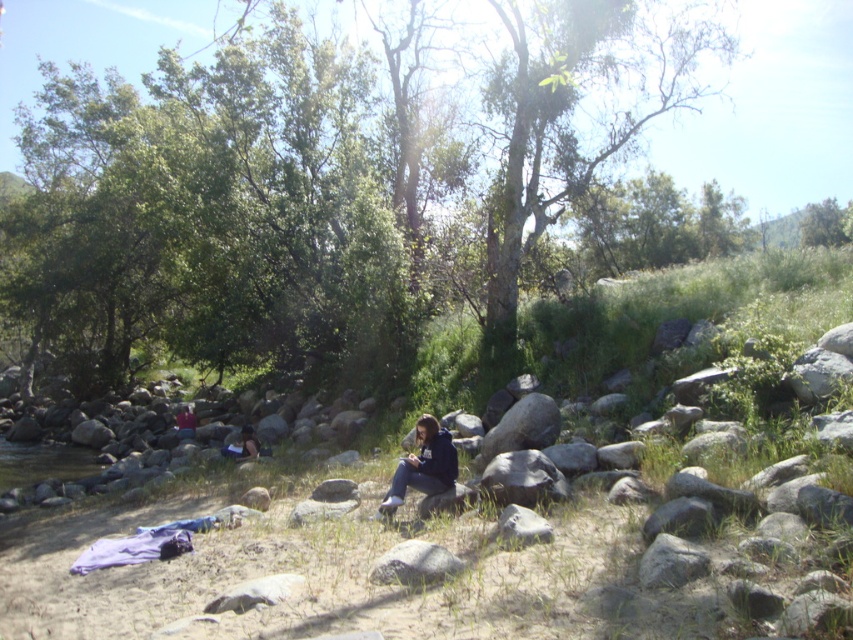
You are planning to set up a picnic blanket between the green leafy tree at upper center and the dark blue jeans at lower left. The picnic blanket requires a space of 15 meters between the two objects to be placed comfortably. Is there enough space between them?

The green leafy tree at upper center and dark blue jeans at lower left are 17.87 meters apart from each other, which is more than the required 15 meters. Therefore, there is enough space to place the picnic blanket comfortably between them.

You are standing at the point with coordinates point [183,426] and want to walk to the point with coordinates point [248,244]. Which direction should you move in relation to the other point?

You should move forward towards point [248,244] since it is in front of point [183,426].

You are standing at the edge of the riverbank and see the gray rough rock at center and the dark blue jeans at center. Which object is positioned more to the right side of the scene?

The gray rough rock at center is positioned more to the right side of the scene compared to the dark blue jeans at center.